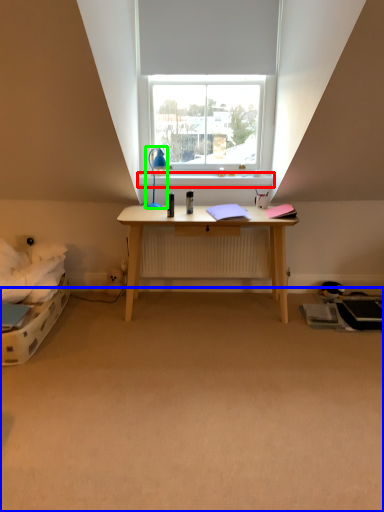
Question: Which object is the closest to the window sill (highlighted by a red box)? Choose among these: plain (highlighted by a blue box) or lamp (highlighted by a green box).

Choices:
 (A) plain
 (B) lamp

Answer: (B)